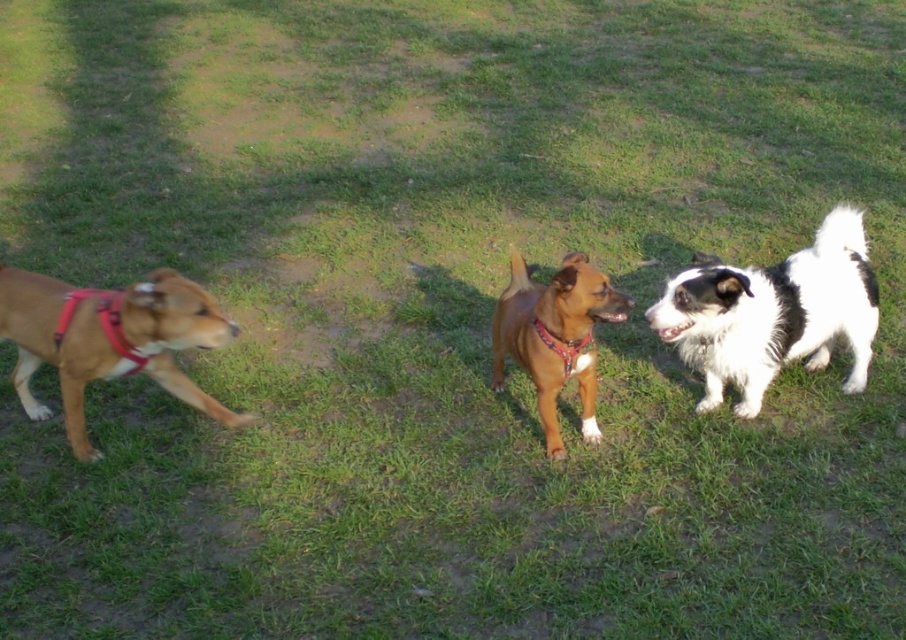
Who is shorter, brown matte dog at left or matte red harness at left?

matte red harness at left is shorter.

Between point (18, 332) and point (111, 298), which one is positioned behind?

Positioned behind is point (18, 332).

Where is `brown matte dog at left`? The height and width of the screenshot is (640, 906). brown matte dog at left is located at coordinates (108, 339).

In order to click on black and white fur dog at right in this screenshot , I will do `click(773, 314)`.

Is black and white fur dog at right smaller than matte red harness at left?

Incorrect, black and white fur dog at right is not smaller in size than matte red harness at left.

Describe the element at coordinates (773, 314) in the screenshot. I see `black and white fur dog at right` at that location.

Find the location of `black and white fur dog at right`. black and white fur dog at right is located at coordinates (773, 314).

You are a GUI agent. You are given a task and a screenshot of the screen. Output one action in this format:
    pyautogui.click(x=<x>, y=<y>)
    Task: Click on the black and white fur dog at right
    The image size is (906, 640).
    Given the screenshot: What is the action you would take?
    pyautogui.click(x=773, y=314)

Between black and white fur dog at right and brown matte dog at left, which one is positioned lower?

brown matte dog at left is below.

This screenshot has width=906, height=640. In order to click on black and white fur dog at right in this screenshot , I will do `click(773, 314)`.